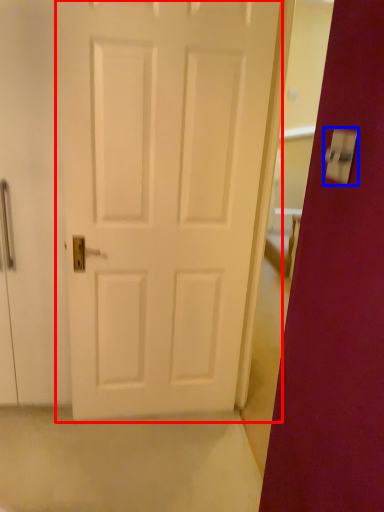
Question: Which point is closer to the camera, door (highlighted by a red box) or light switch (highlighted by a blue box)?

Choices:
 (A) door
 (B) light switch

Answer: (B)